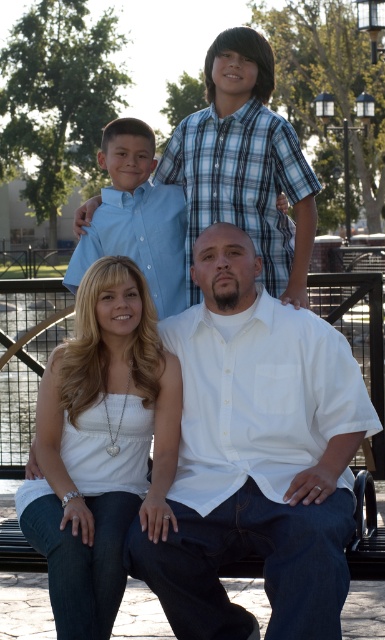
You are a photographer trying to capture a candid shot of both the white cotton shirt at center and the white matte tank top at center. Since both are white, you need to adjust your camera to focus on their positions. Which clothing item is located to the right of the other?

The white cotton shirt at center is positioned on the right side of the white matte tank top at center.

Based on the scene description, where is the white cotton shirt at center located in the image? Please provide its coordinates as a point in the format of a tuple with two decimal numbers rounded to three decimal places, such as 0.123, 0.456.

The white cotton shirt at center is located at coordinates point (257, 456).

You are a photographer trying to capture the family in this image. You notice two white tops at the center of the scene. Which one is wider between the white cotton shirt at center and the white matte tank top at center?

The white cotton shirt at center is wider than the white matte tank top at center according to the description.